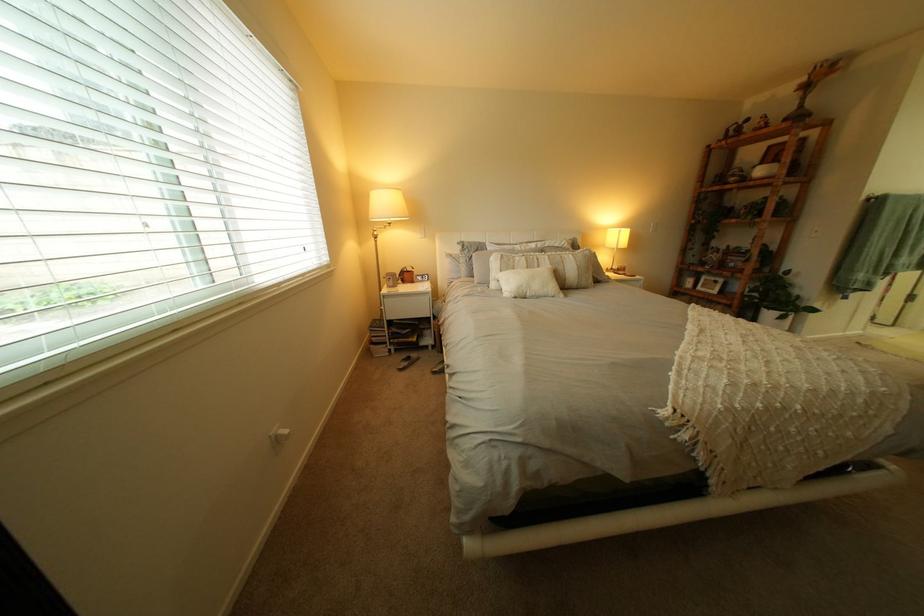
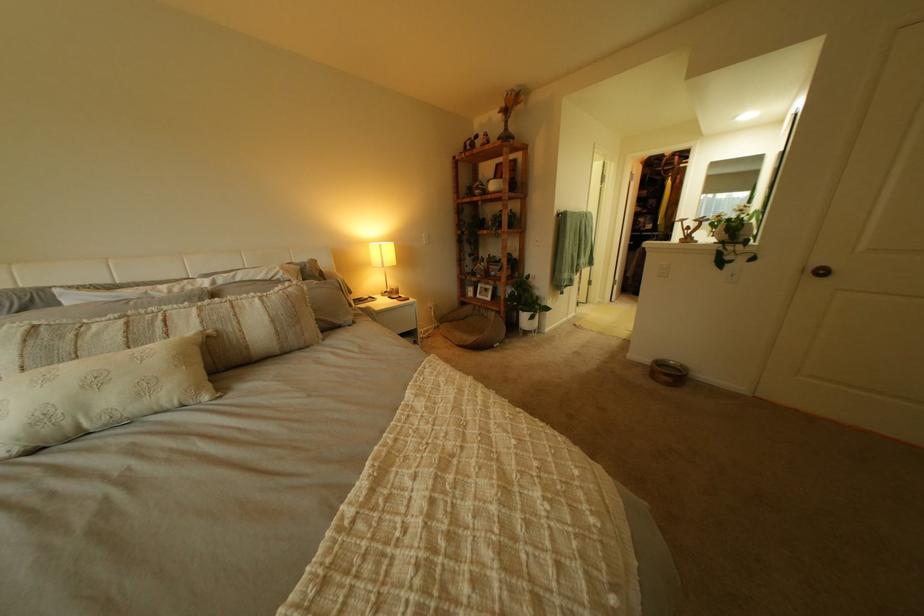
In the second image, find the point that corresponds to (702,291) in the first image.

(485, 300)